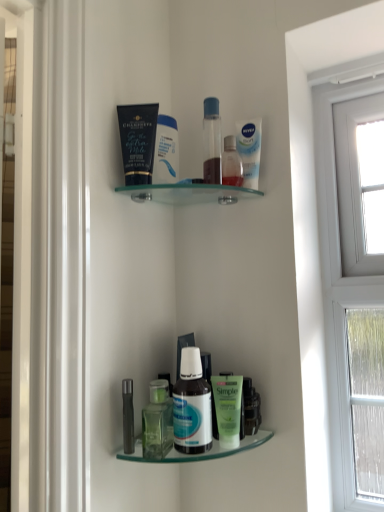
Question: From a real-world perspective, is translucent plastic bottle at upper center, the second toiletry viewed from the top, located higher than green matte lotion at lower center, which is the 3th toiletry in left-to-right order?

Choices:
 (A) no
 (B) yes

Answer: (B)

Question: From a real-world perspective, is translucent plastic bottle at upper center, which is the 4th toiletry in left-to-right order, located beneath green matte lotion at lower center, the 2th toiletry from the right?

Choices:
 (A) yes
 (B) no

Answer: (B)

Question: Does translucent plastic bottle at upper center, which appears as the 1th toiletry when viewed from the right, contain green matte lotion at lower center, which is counted as the 2th toiletry, starting from the bottom?

Choices:
 (A) no
 (B) yes

Answer: (A)

Question: Does translucent plastic bottle at upper center, the second toiletry viewed from the top, have a lesser height compared to green matte lotion at lower center, which is counted as the 2th toiletry, starting from the bottom?

Choices:
 (A) yes
 (B) no

Answer: (A)

Question: Would you consider translucent plastic bottle at upper center, which is the 4th toiletry in left-to-right order, to be distant from green matte lotion at lower center, the 2th toiletry from the right?

Choices:
 (A) yes
 (B) no

Answer: (B)

Question: Can you confirm if translucent plastic bottle at upper center, which appears as the 1th toiletry when viewed from the right, is bigger than green matte lotion at lower center, which is the 3th toiletry in left-to-right order?

Choices:
 (A) no
 (B) yes

Answer: (A)

Question: Can you confirm if green matte bottle at lower center, which is the first bottle from left to right, is thinner than white glossy mouthwash at upper center, which is counted as the 1th mouthwash, starting from the right?

Choices:
 (A) yes
 (B) no

Answer: (B)

Question: Considering the relative sizes of green matte bottle at lower center, which is the first bottle from left to right, and white glossy mouthwash at upper center, marked as the second mouthwash in a left-to-right arrangement, in the image provided, is green matte bottle at lower center, which is the first bottle from left to right, taller than white glossy mouthwash at upper center, marked as the second mouthwash in a left-to-right arrangement,?

Choices:
 (A) yes
 (B) no

Answer: (B)

Question: Could white glossy mouthwash at upper center, marked as the second mouthwash in a left-to-right arrangement, be considered to be inside green matte bottle at lower center, which is the first bottle from left to right?

Choices:
 (A) yes
 (B) no

Answer: (B)

Question: Could you tell me if green matte bottle at lower center, which is the first bottle from left to right, is turned towards white glossy mouthwash at upper center, placed as the second mouthwash when sorted from front to back?

Choices:
 (A) no
 (B) yes

Answer: (A)

Question: Is green matte bottle at lower center, the second bottle from the right, wider than white glossy mouthwash at upper center, the 1th mouthwash positioned from the back?

Choices:
 (A) no
 (B) yes

Answer: (B)

Question: Considering the relative sizes of green matte bottle at lower center, the second bottle from the right, and white glossy mouthwash at upper center, placed as the second mouthwash when sorted from front to back, in the image provided, is green matte bottle at lower center, the second bottle from the right, shorter than white glossy mouthwash at upper center, placed as the second mouthwash when sorted from front to back,?

Choices:
 (A) yes
 (B) no

Answer: (A)

Question: Is metallic silver tube at lower left, which ranks as the fourth toiletry in top-to-bottom order, smaller than white glossy bottle at lower center, which ranks as the second bottle in left-to-right order?

Choices:
 (A) no
 (B) yes

Answer: (B)